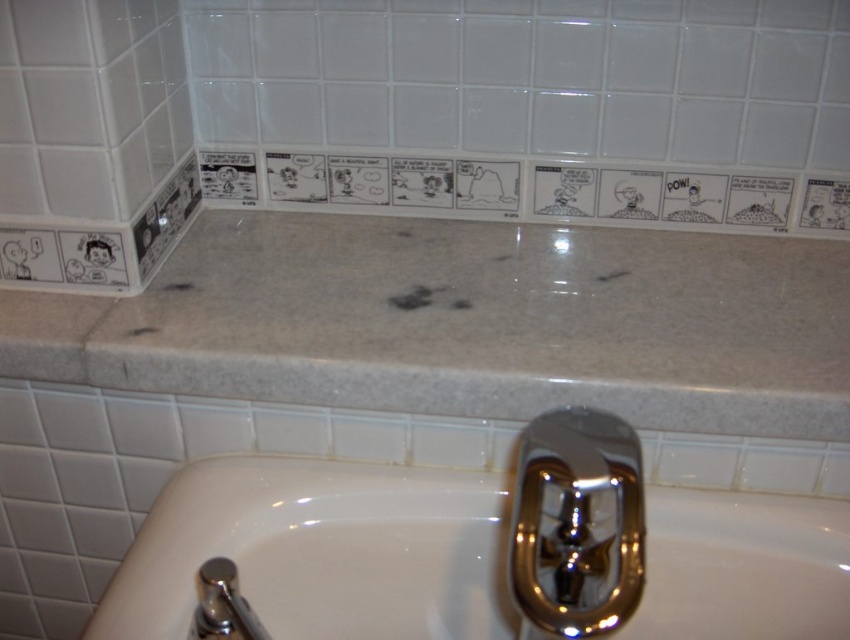
You are standing in front of the bathroom sink. Where is the white marble counter top at upper center located in terms of its 2D coordinates?

The white marble counter top at upper center is located at the 2D coordinates of point (468, 323).

Based on the photo, you are standing in the bathroom and see two points marked on the wall tiles. The first point is at coordinate point (276, 275) and the second point is at coordinate point (204, 632). Which point is closer to you?

Point (276, 275) is closer to you because it is further to the viewer than point (204, 632).

You are trying to place a small decorative item on the bathroom counter. The item is 10 cm wide. Can you fit it on the white marble counter top at upper center without overlapping the polished chrome faucet at lower left?

The white marble counter top at upper center might be wider than the polished chrome faucet at lower left, so there is a possibility that the 10 cm wide item can fit without overlapping. However, the exact dimensions are uncertain based on the provided information.